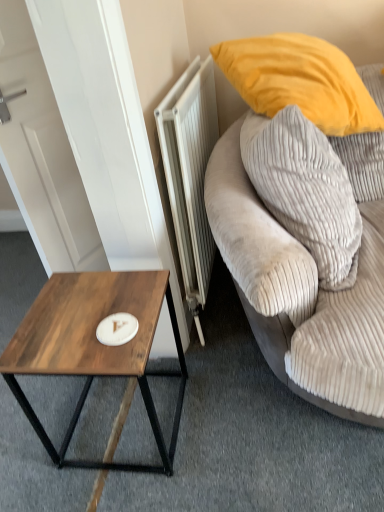
This screenshot has width=384, height=512. Identify the location of vacant space behind white matte plate at center. (112, 294).